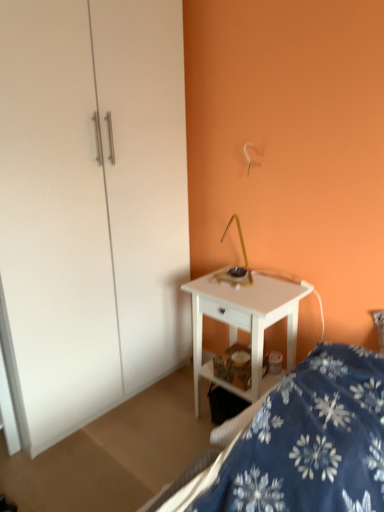
Question: Could you tell me if white glossy desk at center is turned towards blue floral fabric bed at lower right?

Choices:
 (A) yes
 (B) no

Answer: (B)

Question: Is white glossy desk at center closer to camera compared to blue floral fabric bed at lower right?

Choices:
 (A) yes
 (B) no

Answer: (B)

Question: From a real-world perspective, is white glossy desk at center on blue floral fabric bed at lower right?

Choices:
 (A) no
 (B) yes

Answer: (A)

Question: Is white glossy desk at center completely or partially outside of blue floral fabric bed at lower right?

Choices:
 (A) yes
 (B) no

Answer: (A)

Question: Is white glossy desk at center positioned with its back to blue floral fabric bed at lower right?

Choices:
 (A) yes
 (B) no

Answer: (B)

Question: In the image, is white glossy desk at center positioned in front of or behind white glossy dresser at center?

Choices:
 (A) front
 (B) behind

Answer: (B)

Question: From their relative heights in the image, would you say white glossy desk at center is taller or shorter than white glossy dresser at center?

Choices:
 (A) short
 (B) tall

Answer: (A)

Question: Based on their positions, is white glossy desk at center located to the left or right of white glossy dresser at center?

Choices:
 (A) right
 (B) left

Answer: (A)

Question: Do you think white glossy desk at center is within white glossy dresser at center, or outside of it?

Choices:
 (A) outside
 (B) inside

Answer: (A)

Question: From their relative heights in the image, would you say blue floral fabric bed at lower right is taller or shorter than white glossy dresser at center?

Choices:
 (A) short
 (B) tall

Answer: (A)

Question: In terms of width, does blue floral fabric bed at lower right look wider or thinner when compared to white glossy dresser at center?

Choices:
 (A) thin
 (B) wide

Answer: (A)

Question: From the image's perspective, is blue floral fabric bed at lower right located above or below white glossy dresser at center?

Choices:
 (A) above
 (B) below

Answer: (B)

Question: Considering their positions, is blue floral fabric bed at lower right located in front of or behind white glossy dresser at center?

Choices:
 (A) front
 (B) behind

Answer: (A)

Question: In the image, is white glossy dresser at center positioned in front of or behind blue floral fabric bed at lower right?

Choices:
 (A) behind
 (B) front

Answer: (A)

Question: Do you think white glossy dresser at center is within blue floral fabric bed at lower right, or outside of it?

Choices:
 (A) inside
 (B) outside

Answer: (B)